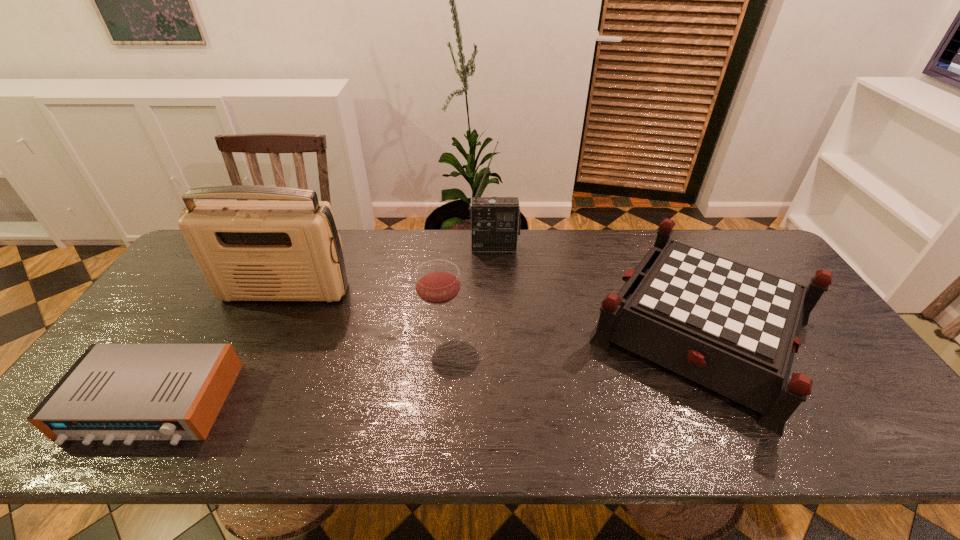
The height and width of the screenshot is (540, 960). I want to click on object that is at the far right corner, so click(x=734, y=329).

I want to click on object present at the near right corner, so click(734, 329).

At what (x,y) coordinates should I click in order to perform the action: click on free space at the far edge of the desktop. Please return your answer as a coordinate pair (x, y). Looking at the image, I should click on (524, 245).

The height and width of the screenshot is (540, 960). I want to click on blank space at the near edge of the desktop, so click(201, 449).

Where is `vacant region at the left edge of the desktop`? This screenshot has width=960, height=540. vacant region at the left edge of the desktop is located at coordinates (151, 334).

You are a GUI agent. You are given a task and a screenshot of the screen. Output one action in this format:
    pyautogui.click(x=<x>, y=<y>)
    Task: Click on the vacant space at the right edge of the desktop
    This screenshot has width=960, height=540.
    Given the screenshot: What is the action you would take?
    pyautogui.click(x=797, y=365)

This screenshot has width=960, height=540. I want to click on blank space at the far right corner of the desktop, so click(x=737, y=255).

Where is `empty location between the third shortest object and the nearest radio receiver`? empty location between the third shortest object and the nearest radio receiver is located at coordinates coord(297,367).

This screenshot has height=540, width=960. I want to click on unoccupied area between the farthest radio receiver and the second farthest radio receiver, so click(x=390, y=269).

Locate an element on the screen. This screenshot has width=960, height=540. vacant area that lies between the second farthest radio receiver and the farthest radio receiver is located at coordinates (390, 269).